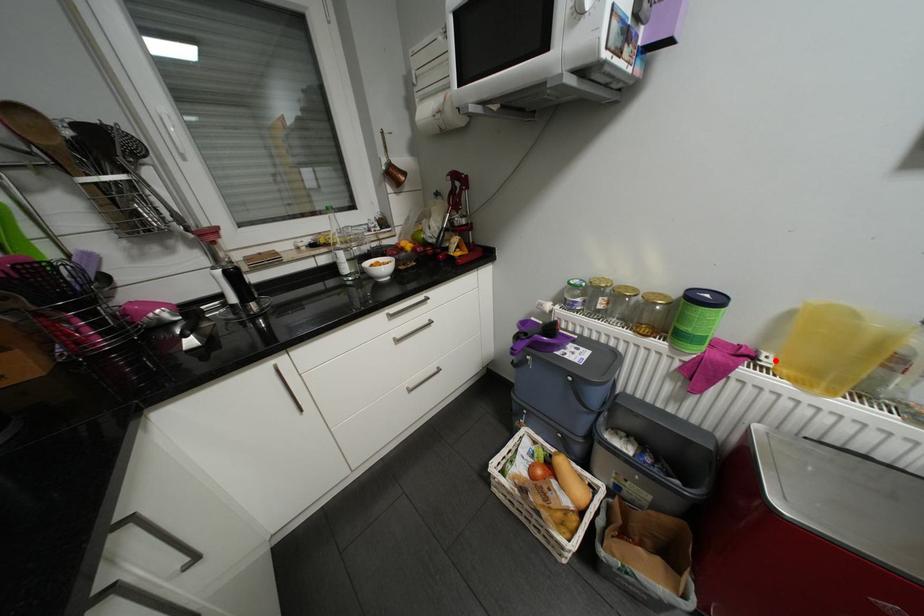
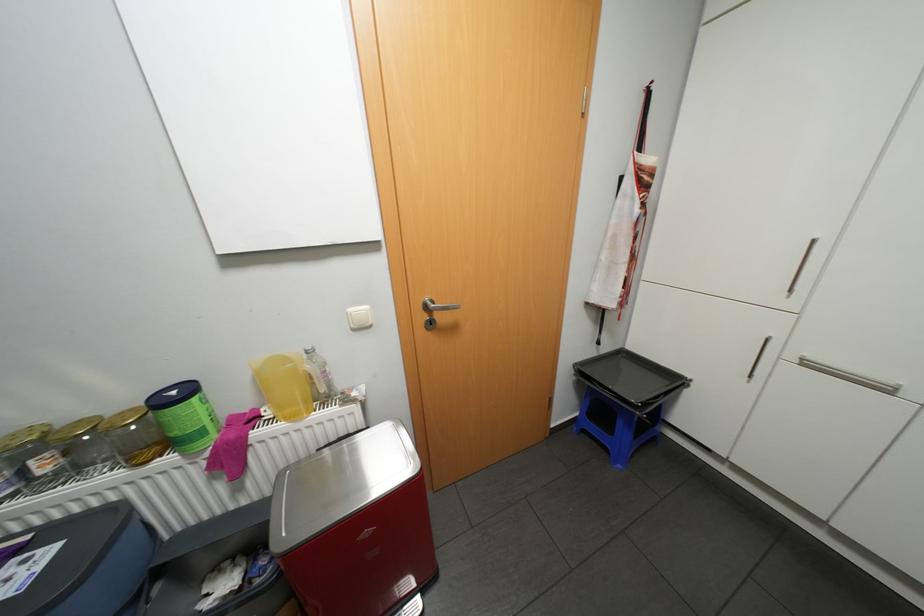
Locate, in the second image, the point that corresponds to the highlighted location in the first image.

(275, 413)